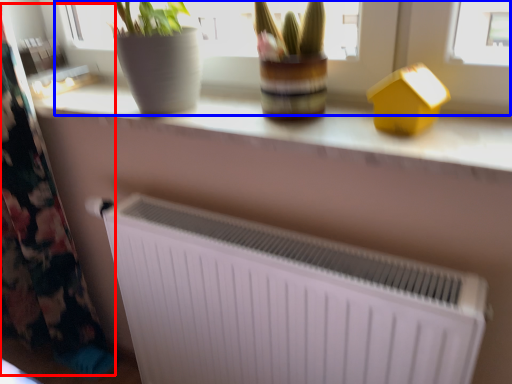
Question: Which of the following is the farthest to the observer, curtain (highlighted by a red box) or bay window (highlighted by a blue box)?

Choices:
 (A) curtain
 (B) bay window

Answer: (A)